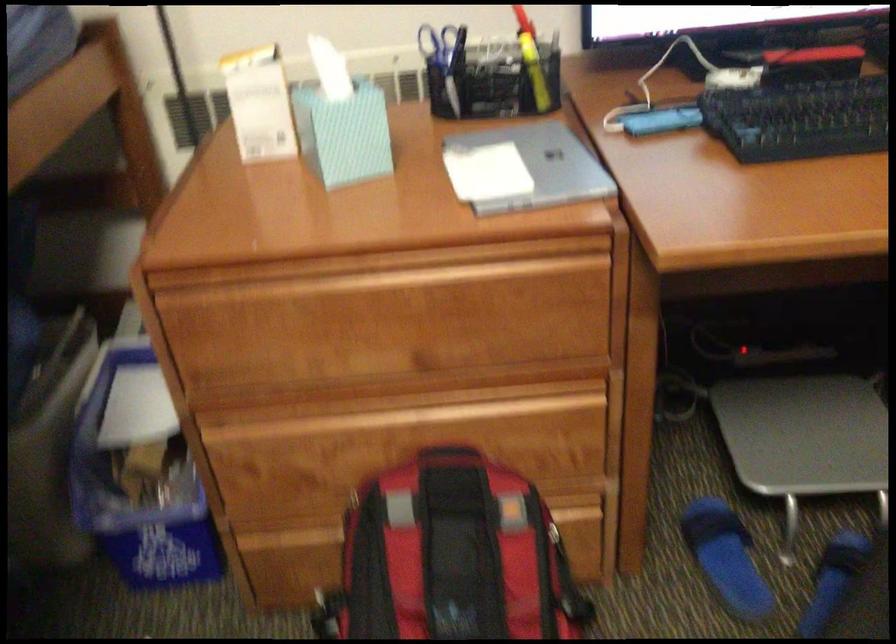
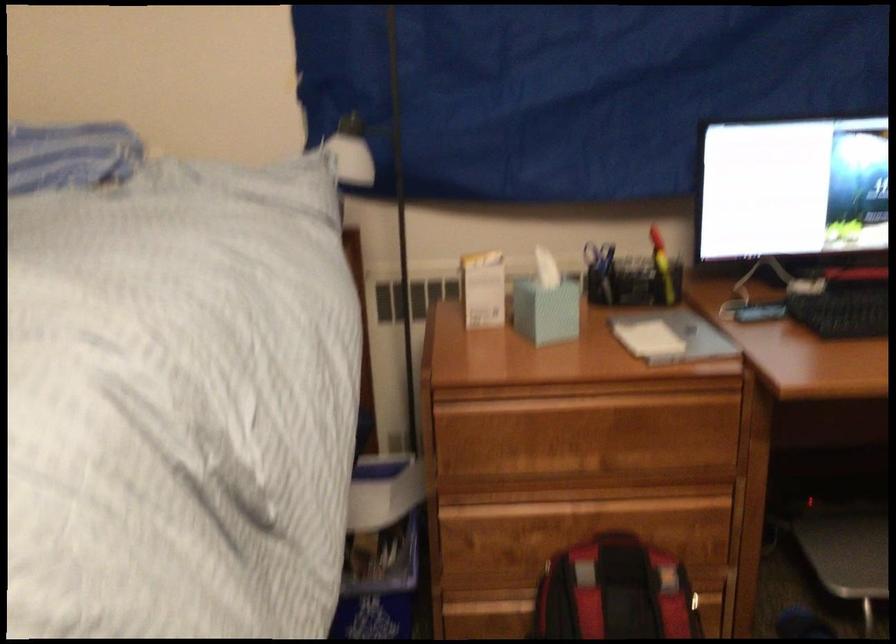
The point at (336,138) is marked in the first image. Where is the corresponding point in the second image?

(546, 310)